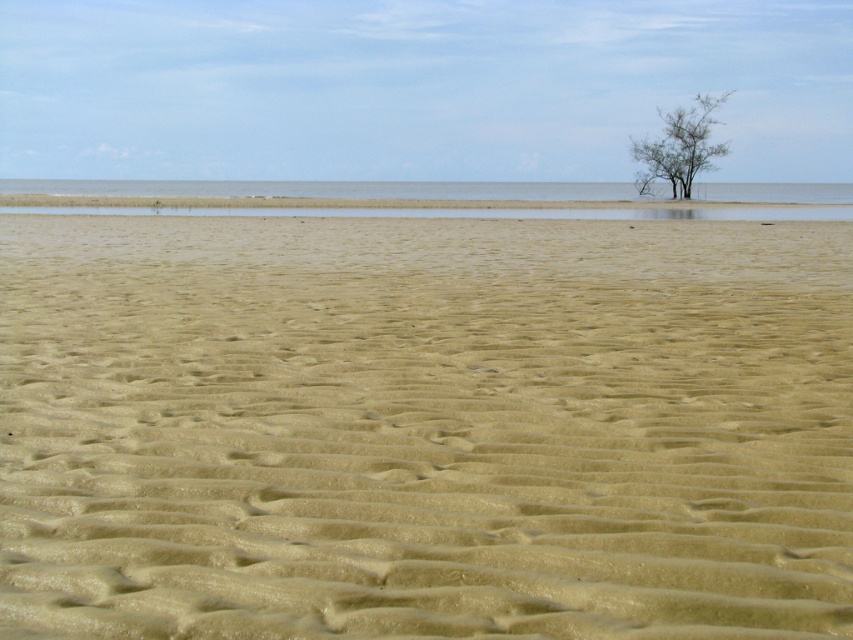
From the picture: You are standing on the beach and want to walk towards the green leafy tree at upper right. Which direction should you move relative to the smooth sand at center?

You should move towards the upper right direction away from the smooth sand at center, since the green leafy tree at upper right is further away from the viewer compared to the smooth sand at center.

You are standing on the beach and want to walk towards the point labeled as point (679, 147). However, you notice another point, point (625, 184), which is closer to you. Which point should you head towards if you want to reach the one nearest to your current position?

You should head towards point (625, 184) because it is closer to you than point (679, 147).

You are standing at the edge of the beach and see the smooth sand at center and the clear water at center. Which surface is lower in elevation?

The smooth sand at center has a lesser height compared to the clear water at center, so the smooth sand at center is lower in elevation.